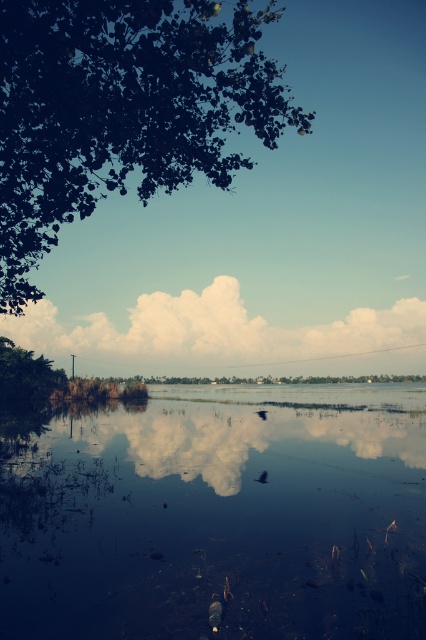
You are standing at the edge of the scene and want to take a photo of the glossy reflective water at center and the white fluffy cloud at center. Which object will appear closer to the camera in your photo?

The glossy reflective water at center will appear closer to the camera because it is shorter than the white fluffy cloud at center, meaning it is positioned closer to the viewer.

You are standing at the edge of the water in the serene landscape scene. There are two points marked in the image, point A at coordinates point A is point (x=368, y=588) and point B at point B is point (x=400, y=323). If you want to reach the point that is closer to you, which point should you head towards?

You should head towards point A at coordinates point (x=368, y=588) because it is closer to the viewer than point B at point (x=400, y=323).

You are standing at the edge of the water and want to take a photo of the green leafy tree at upper left and the glossy reflective water at center. Which object is positioned to the right side of the other?

The glossy reflective water at center is to the right of the green leafy tree at upper left.